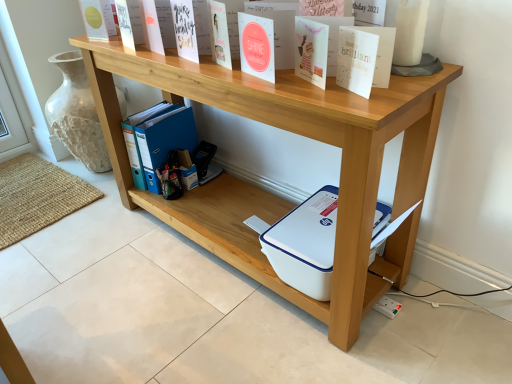
I want to click on free space in front of matte yellow card at upper left, marked as the 1th paperback book in a back-to-front arrangement, so click(110, 45).